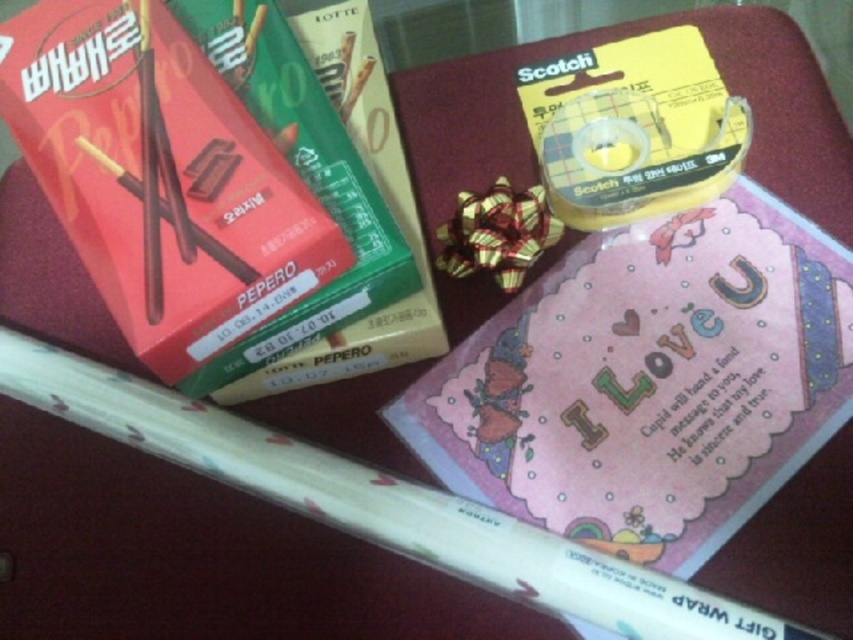
Question: Is pink paper card at upper center in front of matte red box at upper left?

Choices:
 (A) no
 (B) yes

Answer: (B)

Question: Which point is farther to the camera?

Choices:
 (A) matte red box at upper left
 (B) pink paper card at upper center

Answer: (A)

Question: Observing the image, what is the correct spatial positioning of pink paper card at upper center in reference to matte red box at upper left?

Choices:
 (A) below
 (B) above

Answer: (A)

Question: Which of the following is the closest to the observer?

Choices:
 (A) matte red box at upper left
 (B) pink paper card at upper center

Answer: (B)

Question: Can you confirm if pink paper card at upper center is smaller than matte red box at upper left?

Choices:
 (A) no
 (B) yes

Answer: (A)